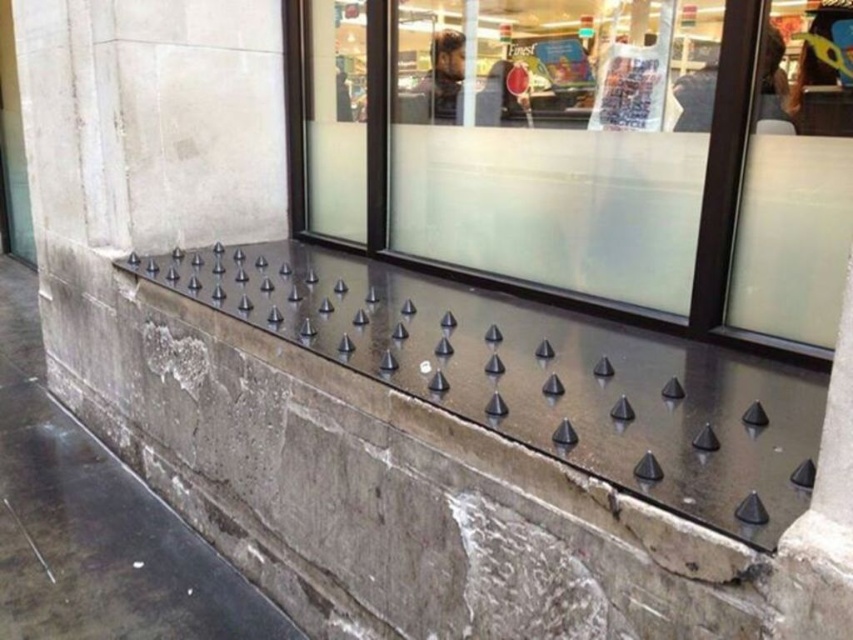
Question: Which object is closer to the camera taking this photo?

Choices:
 (A) transparent glass at center
 (B) black rubber spikes at upper center

Answer: (A)

Question: Which object appears closest to the camera in this image?

Choices:
 (A) transparent glass at center
 (B) black rubber spikes at upper center

Answer: (A)

Question: Can you confirm if transparent glass at center is bigger than black rubber spikes at upper center?

Choices:
 (A) no
 (B) yes

Answer: (A)

Question: Is the position of transparent glass at center more distant than that of black rubber spikes at upper center?

Choices:
 (A) no
 (B) yes

Answer: (A)

Question: Which of the following is the closest to the observer?

Choices:
 (A) transparent glass at center
 (B) black rubber spikes at upper center

Answer: (A)

Question: Is transparent glass at center below black rubber spikes at upper center?

Choices:
 (A) yes
 (B) no

Answer: (B)